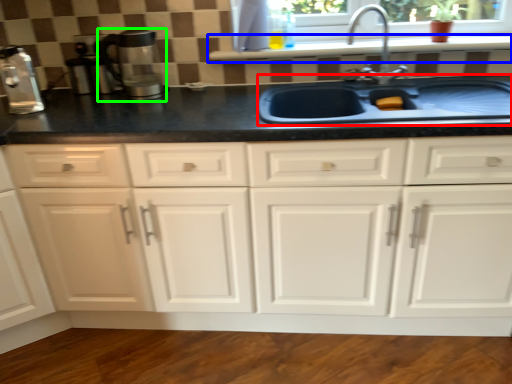
Question: Which object is the closest to the sink (highlighted by a red box)? Choose among these: window sill (highlighted by a blue box) or coffee machine (highlighted by a green box).

Choices:
 (A) window sill
 (B) coffee machine

Answer: (A)